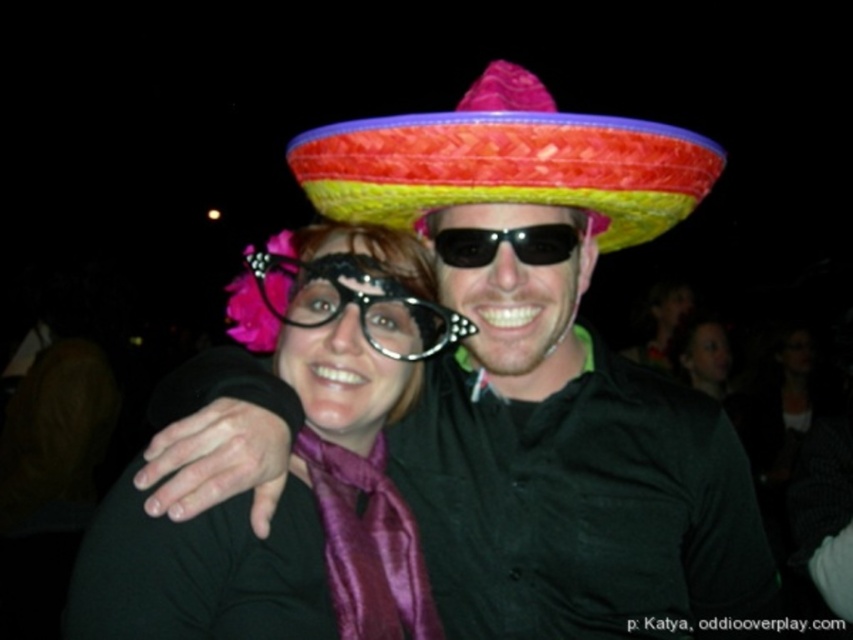
Find the location of `matte black shirt at center`. matte black shirt at center is located at coordinates (552, 376).

Is matte black shirt at center further to the viewer compared to matte purple scarf at center?

No, matte black shirt at center is closer to the viewer.

Locate an element on the screen. matte black shirt at center is located at coordinates (552, 376).

Does black plastic sunglasses at center appear on the left side of matte purple scarf at center?

Indeed, black plastic sunglasses at center is positioned on the left side of matte purple scarf at center.

This screenshot has width=853, height=640. Describe the element at coordinates (506, 241) in the screenshot. I see `black plastic sunglasses at center` at that location.

Where is `black plastic sunglasses at center`? The height and width of the screenshot is (640, 853). black plastic sunglasses at center is located at coordinates (506, 241).

Can you confirm if multicolored woven sombrero at center is smaller than black plastic sunglasses at center?

Incorrect, multicolored woven sombrero at center is not smaller in size than black plastic sunglasses at center.

Which is more to the left, multicolored woven sombrero at center or black plastic sunglasses at center?

black plastic sunglasses at center is more to the left.

The width and height of the screenshot is (853, 640). What do you see at coordinates (508, 163) in the screenshot?
I see `multicolored woven sombrero at center` at bounding box center [508, 163].

Where is `multicolored woven sombrero at center`? Image resolution: width=853 pixels, height=640 pixels. multicolored woven sombrero at center is located at coordinates (508, 163).